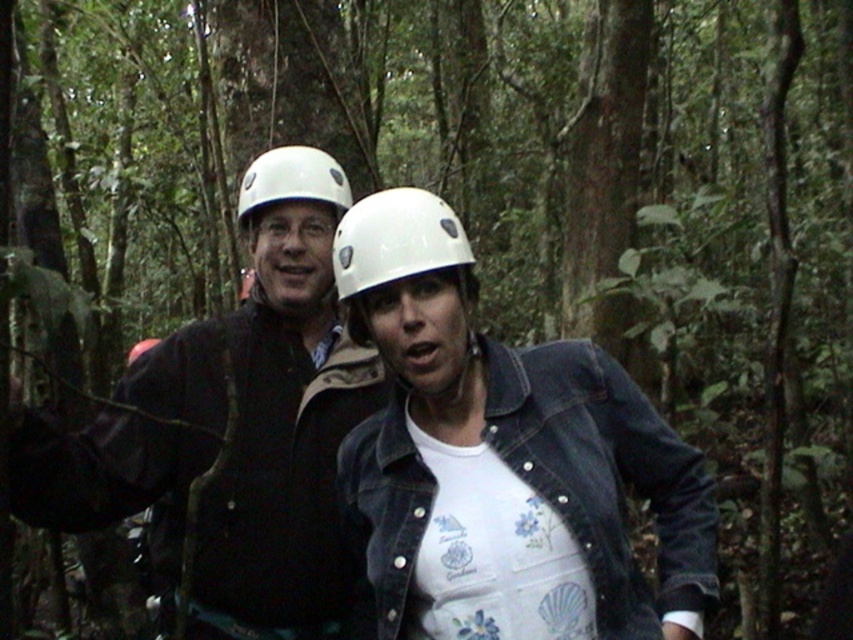
You are navigating through the forest and need to reach a specific point. You see two points marked in the image. Which point is closer to you, point [247,177] or point [282,160]?

Point [247,177] is closer to you because it is further to the viewer than point [282,160].